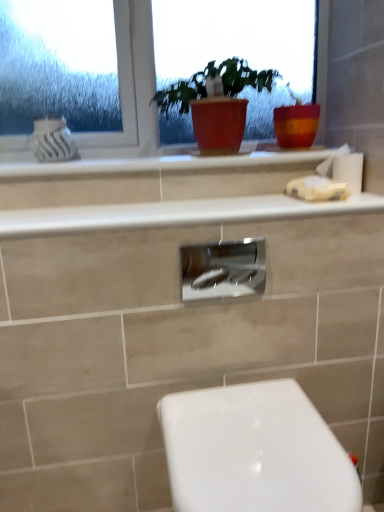
Question: Is matte red pot at center further to camera compared to satin nickel faucet at center?

Choices:
 (A) no
 (B) yes

Answer: (B)

Question: Does matte red pot at center have a greater height compared to satin nickel faucet at center?

Choices:
 (A) yes
 (B) no

Answer: (A)

Question: Is matte red pot at center shorter than satin nickel faucet at center?

Choices:
 (A) yes
 (B) no

Answer: (B)

Question: Is matte red pot at center not within satin nickel faucet at center?

Choices:
 (A) yes
 (B) no

Answer: (A)

Question: From a real-world perspective, is matte red pot at center over satin nickel faucet at center?

Choices:
 (A) no
 (B) yes

Answer: (B)

Question: Is matte red pot at center bigger than satin nickel faucet at center?

Choices:
 (A) no
 (B) yes

Answer: (B)

Question: Is the position of white glossy counter top at upper center, positioned as the first counter top in top-to-bottom order, more distant than that of white glossy counter top at upper center, the 1th counter top from the bottom?

Choices:
 (A) no
 (B) yes

Answer: (B)

Question: Is white glossy counter top at upper center, the 1th counter top from the bottom, at the back of white glossy counter top at upper center, positioned as the first counter top in top-to-bottom order?

Choices:
 (A) no
 (B) yes

Answer: (A)

Question: Considering the relative sizes of white glossy counter top at upper center, positioned as the first counter top in top-to-bottom order, and white glossy counter top at upper center, the 1th counter top from the bottom, in the image provided, is white glossy counter top at upper center, positioned as the first counter top in top-to-bottom order, bigger than white glossy counter top at upper center, the 1th counter top from the bottom,?

Choices:
 (A) yes
 (B) no

Answer: (B)

Question: From a real-world perspective, is white glossy counter top at upper center, positioned as the first counter top in top-to-bottom order, on top of white glossy counter top at upper center, the 1th counter top from the bottom?

Choices:
 (A) no
 (B) yes

Answer: (B)

Question: Is white glossy counter top at upper center, positioned as the first counter top in top-to-bottom order, directly adjacent to white glossy counter top at upper center, the 2th counter top viewed from the top?

Choices:
 (A) no
 (B) yes

Answer: (A)

Question: Does white glossy counter top at upper center, which ranks as the second counter top in bottom-to-top order, have a smaller size compared to white glossy counter top at upper center, the 1th counter top from the bottom?

Choices:
 (A) yes
 (B) no

Answer: (A)

Question: Is white glossy toilet at lower right surrounding matte red pot at center?

Choices:
 (A) no
 (B) yes

Answer: (A)